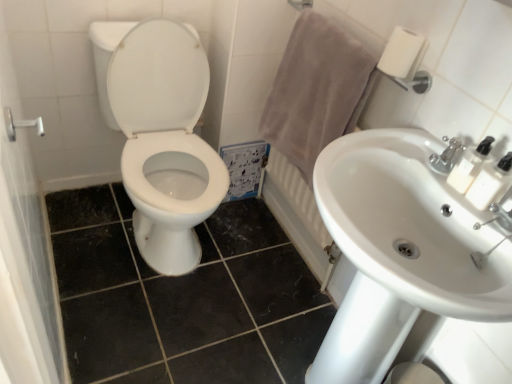
Where is `unoccupied area behind white plastic soap dispenser at upper right, marked as the second soap dispenser in a bottom-to-top arrangement`? Image resolution: width=512 pixels, height=384 pixels. unoccupied area behind white plastic soap dispenser at upper right, marked as the second soap dispenser in a bottom-to-top arrangement is located at coordinates (426, 140).